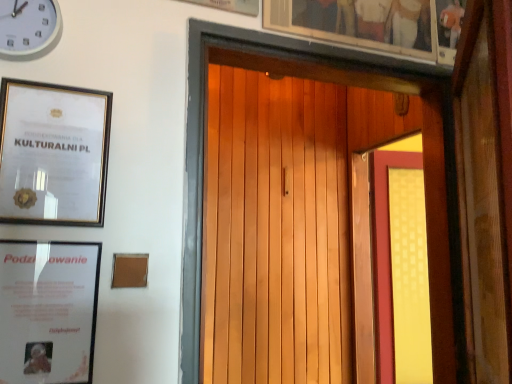
Question: Is the depth of wooden picture frame at upper center, positioned as the 3th picture frame in bottom-to-top order, less than that of wooden picture frame at upper center, the first picture frame viewed from the top?

Choices:
 (A) no
 (B) yes

Answer: (A)

Question: Is wooden picture frame at upper center, the first picture frame when ordered from right to left, thinner than wooden picture frame at upper center, which is counted as the 2th picture frame, starting from the right?

Choices:
 (A) yes
 (B) no

Answer: (A)

Question: Considering the relative positions of wooden picture frame at upper center, which ranks as the second picture frame in top-to-bottom order, and wooden picture frame at upper center, the 4th picture frame from the bottom, in the image provided, is wooden picture frame at upper center, which ranks as the second picture frame in top-to-bottom order, to the right of wooden picture frame at upper center, the 4th picture frame from the bottom, from the viewer's perspective?

Choices:
 (A) yes
 (B) no

Answer: (A)

Question: From the image's perspective, would you say wooden picture frame at upper center, the first picture frame when ordered from right to left, is positioned over wooden picture frame at upper center, the first picture frame viewed from the top?

Choices:
 (A) yes
 (B) no

Answer: (B)

Question: Can you confirm if wooden picture frame at upper center, the first picture frame when ordered from right to left, is shorter than wooden picture frame at upper center, the third picture frame in the left-to-right sequence?

Choices:
 (A) no
 (B) yes

Answer: (B)

Question: Considering the relative sizes of wooden picture frame at upper center, which ranks as the second picture frame in top-to-bottom order, and wooden picture frame at upper center, the first picture frame viewed from the top, in the image provided, is wooden picture frame at upper center, which ranks as the second picture frame in top-to-bottom order, smaller than wooden picture frame at upper center, the first picture frame viewed from the top,?

Choices:
 (A) no
 (B) yes

Answer: (B)

Question: Is wooden door at center surrounded by matte white picture frame at lower left, which is the 1th picture frame in left-to-right order?

Choices:
 (A) no
 (B) yes

Answer: (A)

Question: From the image's perspective, does matte white picture frame at lower left, which ranks as the fourth picture frame in top-to-bottom order, appear higher than wooden door at center?

Choices:
 (A) no
 (B) yes

Answer: (A)

Question: From a real-world perspective, is matte white picture frame at lower left, which is the fourth picture frame from right to left, on top of wooden door at center?

Choices:
 (A) yes
 (B) no

Answer: (B)

Question: From the image's perspective, would you say matte white picture frame at lower left, the first picture frame from the bottom, is shown under wooden door at center?

Choices:
 (A) no
 (B) yes

Answer: (B)

Question: Could you tell me if matte white picture frame at lower left, the first picture frame from the bottom, is facing wooden door at center?

Choices:
 (A) yes
 (B) no

Answer: (B)

Question: Considering the relative sizes of wooden picture frame at upper center, the third picture frame in the left-to-right sequence, and wooden picture frame at upper center, the 4th picture frame positioned from the left, in the image provided, is wooden picture frame at upper center, the third picture frame in the left-to-right sequence, thinner than wooden picture frame at upper center, the 4th picture frame positioned from the left,?

Choices:
 (A) no
 (B) yes

Answer: (A)